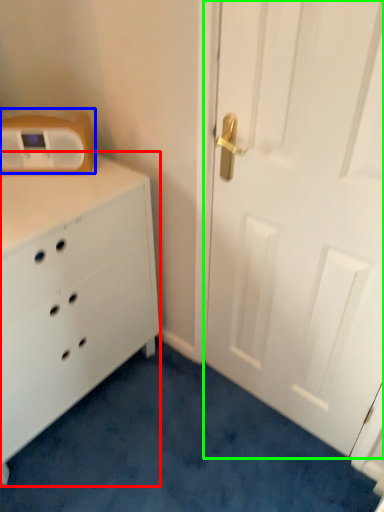
Question: Which object is the closest to the chest of drawers (highlighted by a red box)? Choose among these: appliance (highlighted by a blue box) or door (highlighted by a green box).

Choices:
 (A) appliance
 (B) door

Answer: (A)